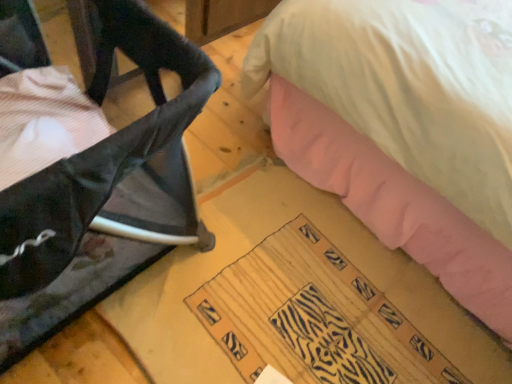
You are a GUI agent. You are given a task and a screenshot of the screen. Output one action in this format:
    pyautogui.click(x=<x>, y=<y>)
    Task: Click on the black mesh chair at left
    
    Given the screenshot: What is the action you would take?
    pyautogui.click(x=104, y=188)

Describe the element at coordinates (104, 188) in the screenshot. I see `black mesh chair at left` at that location.

From the picture: In order to face black mesh chair at left, should I rotate leftwards or rightwards?

You should look left and rotate roughly 27.146 degrees.

Describe the element at coordinates (313, 317) in the screenshot. I see `zebra-patterned fabric at lower center` at that location.

The image size is (512, 384). Identify the location of zebra-patterned fabric at lower center. (313, 317).

Find the location of a particular element. black mesh chair at left is located at coordinates (104, 188).

Considering the positions of objects zebra-patterned fabric at lower center and black mesh chair at left in the image provided, who is more to the right, zebra-patterned fabric at lower center or black mesh chair at left?

zebra-patterned fabric at lower center.

Considering their positions, is zebra-patterned fabric at lower center located in front of or behind black mesh chair at left?

Visually, zebra-patterned fabric at lower center is located behind black mesh chair at left.

Which is behind, point (342, 272) or point (40, 63)?

The point (342, 272) is more distant.

From the image's perspective, is zebra-patterned fabric at lower center above black mesh chair at left?

Incorrect, from the image's perspective, zebra-patterned fabric at lower center is lower than black mesh chair at left.

Based on the photo, from a real-world perspective, relative to black mesh chair at left, is zebra-patterned fabric at lower center vertically above or below?

From a real-world perspective, zebra-patterned fabric at lower center is physically below black mesh chair at left.

Which object is wider, zebra-patterned fabric at lower center or black mesh chair at left?

Wider between the two is black mesh chair at left.

Who is shorter, zebra-patterned fabric at lower center or black mesh chair at left?

With less height is zebra-patterned fabric at lower center.

Is zebra-patterned fabric at lower center bigger or smaller than black mesh chair at left?

Considering their sizes, zebra-patterned fabric at lower center takes up less space than black mesh chair at left.

From the picture: Is zebra-patterned fabric at lower center surrounding black mesh chair at left?

No, zebra-patterned fabric at lower center does not contain black mesh chair at left.

Is zebra-patterned fabric at lower center far away from black mesh chair at left?

That's not correct — zebra-patterned fabric at lower center is a little close to black mesh chair at left.

Consider the image. Is zebra-patterned fabric at lower center looking in the opposite direction of black mesh chair at left?

No, black mesh chair at left is not at the back of zebra-patterned fabric at lower center.

Measure the distance between zebra-patterned fabric at lower center and black mesh chair at left.

The distance of zebra-patterned fabric at lower center from black mesh chair at left is 19.82 inches.

Where is `writing to the right of black mesh chair at left`? Image resolution: width=512 pixels, height=384 pixels. writing to the right of black mesh chair at left is located at coordinates (313, 317).

Which is more to the left, black mesh chair at left or zebra-patterned fabric at lower center?

black mesh chair at left is more to the left.

Is the position of black mesh chair at left more distant than that of zebra-patterned fabric at lower center?

No, black mesh chair at left is in front of zebra-patterned fabric at lower center.

Which is closer to the camera, [111,26] or [265,265]?

Positioned in front is point [111,26].

From the image's perspective, between black mesh chair at left and zebra-patterned fabric at lower center, which one is located above?

black mesh chair at left is shown above in the image.

From a real-world perspective, is black mesh chair at left above or below zebra-patterned fabric at lower center?

In terms of real-world spatial position, black mesh chair at left is above zebra-patterned fabric at lower center.

Which object is wider, black mesh chair at left or zebra-patterned fabric at lower center?

black mesh chair at left.

Which of these two, black mesh chair at left or zebra-patterned fabric at lower center, stands shorter?

zebra-patterned fabric at lower center is shorter.

Is black mesh chair at left bigger than zebra-patterned fabric at lower center?

Correct, black mesh chair at left is larger in size than zebra-patterned fabric at lower center.

Does black mesh chair at left contain zebra-patterned fabric at lower center?

No, zebra-patterned fabric at lower center is not surrounded by black mesh chair at left.

Is black mesh chair at left beside zebra-patterned fabric at lower center?

black mesh chair at left and zebra-patterned fabric at lower center are not in contact.

Could you tell me if black mesh chair at left is turned towards zebra-patterned fabric at lower center?

Yes, black mesh chair at left is aimed at zebra-patterned fabric at lower center.

How different are the orientations of black mesh chair at left and zebra-patterned fabric at lower center in degrees?

They differ by 91.2 degrees in their facing directions.

This screenshot has width=512, height=384. What are the coordinates of `writing behind the black mesh chair at left` in the screenshot? It's located at (313, 317).

You are a GUI agent. You are given a task and a screenshot of the screen. Output one action in this format:
    pyautogui.click(x=<x>, y=<y>)
    Task: Click on the furniture above the zebra-patterned fabric at lower center (from a real-world perspective)
    
    Given the screenshot: What is the action you would take?
    pyautogui.click(x=104, y=188)

This screenshot has height=384, width=512. In order to click on writing below the black mesh chair at left (from a real-world perspective) in this screenshot , I will do `click(313, 317)`.